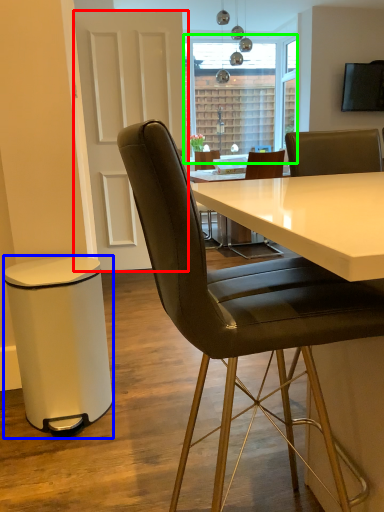
Question: Considering the real-world distances, which object is closest to glass door (highlighted by a red box)? bar stool (highlighted by a blue box) or window screen (highlighted by a green box).

Choices:
 (A) bar stool
 (B) window screen

Answer: (A)